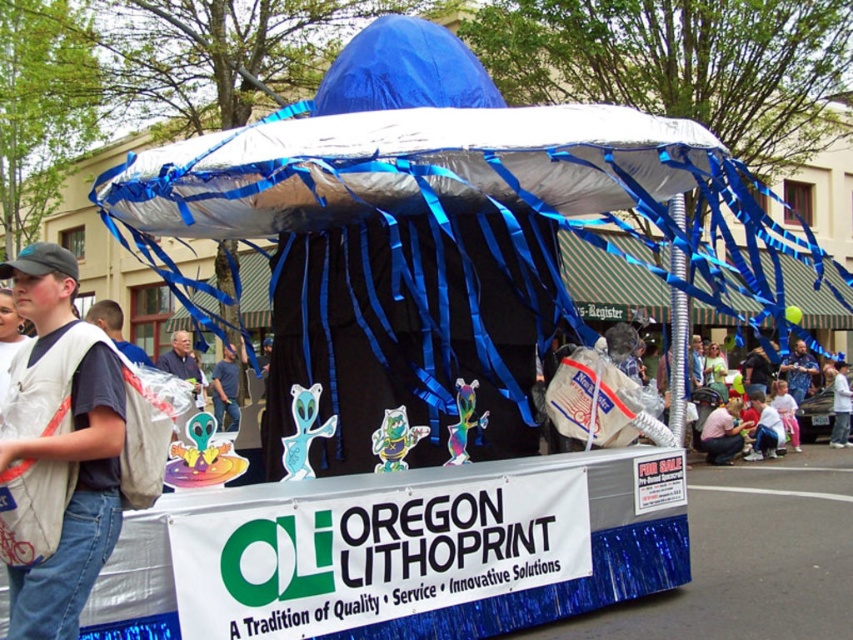
Question: Does white fabric vest at center appear under blue fabric shirt at center?

Choices:
 (A) no
 (B) yes

Answer: (A)

Question: Which point is closer to the camera?

Choices:
 (A) (73, 454)
 (B) (183, 364)

Answer: (A)

Question: Does white fabric vest at center have a larger size compared to blue fabric shirt at center?

Choices:
 (A) yes
 (B) no

Answer: (B)

Question: Is white fabric vest at center positioned before blue fabric shirt at center?

Choices:
 (A) yes
 (B) no

Answer: (A)

Question: Among these points, which one is farthest from the camera?

Choices:
 (A) (189, 332)
 (B) (111, 486)

Answer: (A)

Question: Among these objects, which one is nearest to the camera?

Choices:
 (A) blue fabric shirt at center
 (B) white fabric vest at center

Answer: (B)